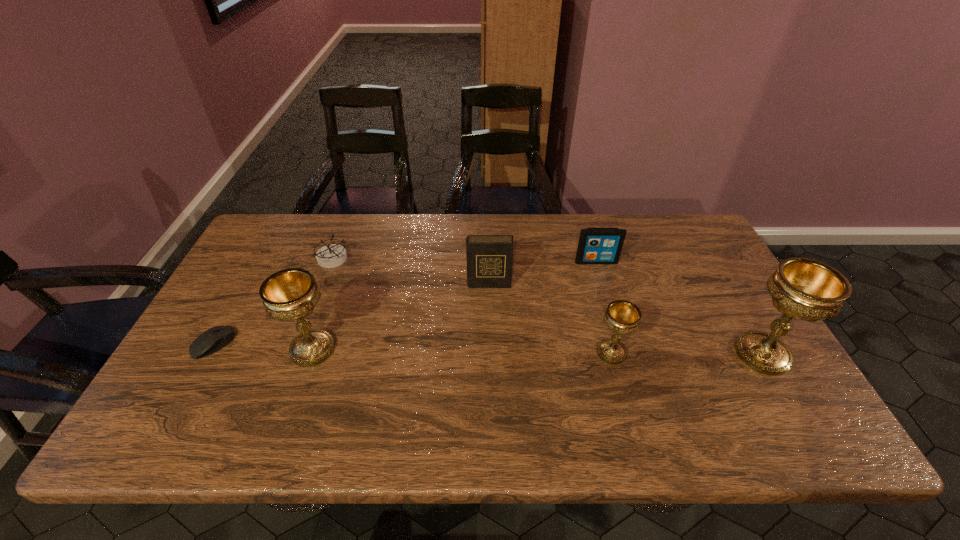
You are a GUI agent. You are given a task and a screenshot of the screen. Output one action in this format:
    pyautogui.click(x=<x>, y=<y>)
    Task: Click on the blank space that satisfies the following two spatial constraints: 1. on the front cover of the second chalice from right to left; 2. on the right side of the diary
    The width and height of the screenshot is (960, 540).
    Given the screenshot: What is the action you would take?
    pyautogui.click(x=491, y=353)

You are a GUI agent. You are given a task and a screenshot of the screen. Output one action in this format:
    pyautogui.click(x=<x>, y=<y>)
    Task: Click on the vacant region that satisfies the following two spatial constraints: 1. on the front side of the leftmost object; 2. on the left side of the second tallest object
    
    Given the screenshot: What is the action you would take?
    pyautogui.click(x=210, y=349)

You are a GUI agent. You are given a task and a screenshot of the screen. Output one action in this format:
    pyautogui.click(x=<x>, y=<y>)
    Task: Click on the free location that satisfies the following two spatial constraints: 1. on the back side of the leftmost object; 2. on the right side of the second shortest object
    
    Given the screenshot: What is the action you would take?
    pyautogui.click(x=260, y=259)

Locate an element on the screen. This screenshot has width=960, height=540. vacant space that satisfies the following two spatial constraints: 1. on the back side of the computer equipment; 2. on the right side of the second shortest object is located at coordinates (260, 259).

Where is `free spot that satisfies the following two spatial constraints: 1. on the front cover of the shortest chalice; 2. on the left side of the diary`? This screenshot has width=960, height=540. free spot that satisfies the following two spatial constraints: 1. on the front cover of the shortest chalice; 2. on the left side of the diary is located at coordinates (491, 353).